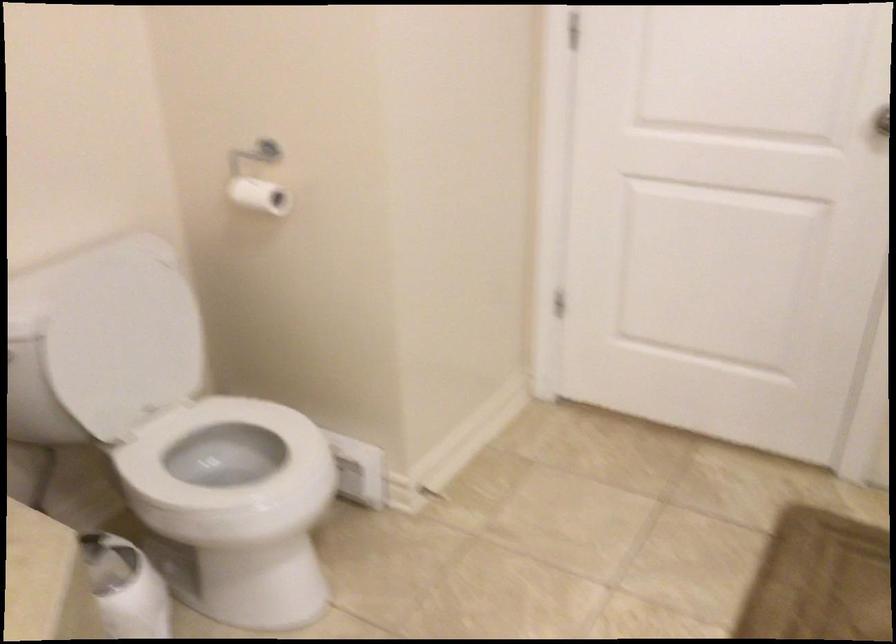
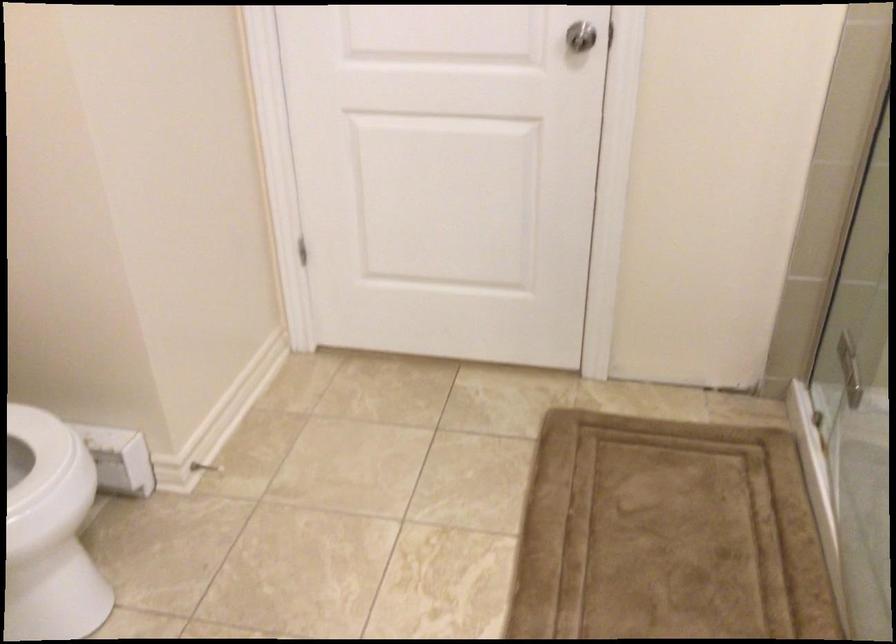
Question: The images are taken continuously from a first-person perspective. In which direction is your viewpoint rotating?

Choices:
 (A) Left
 (B) Right
 (C) Up
 (D) Down

Answer: (B)